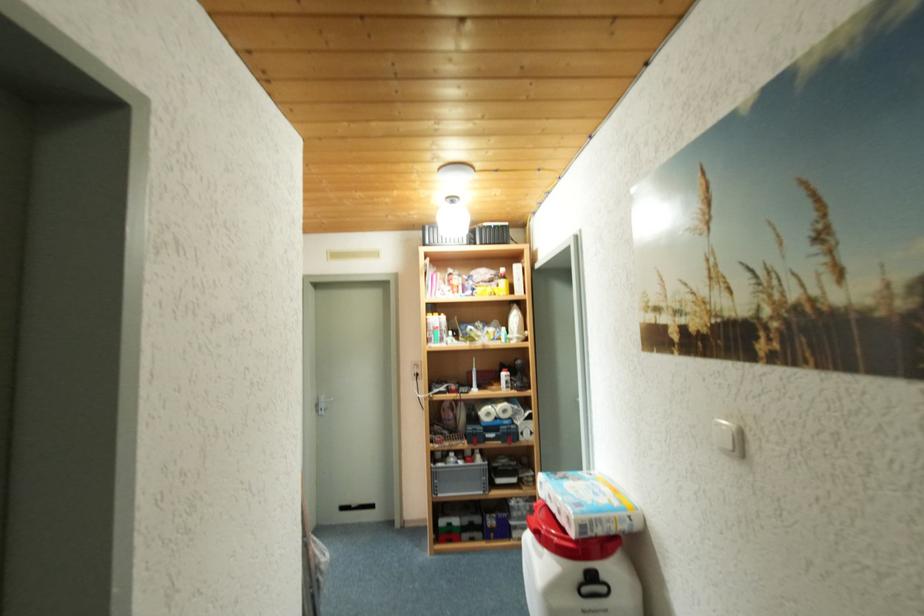
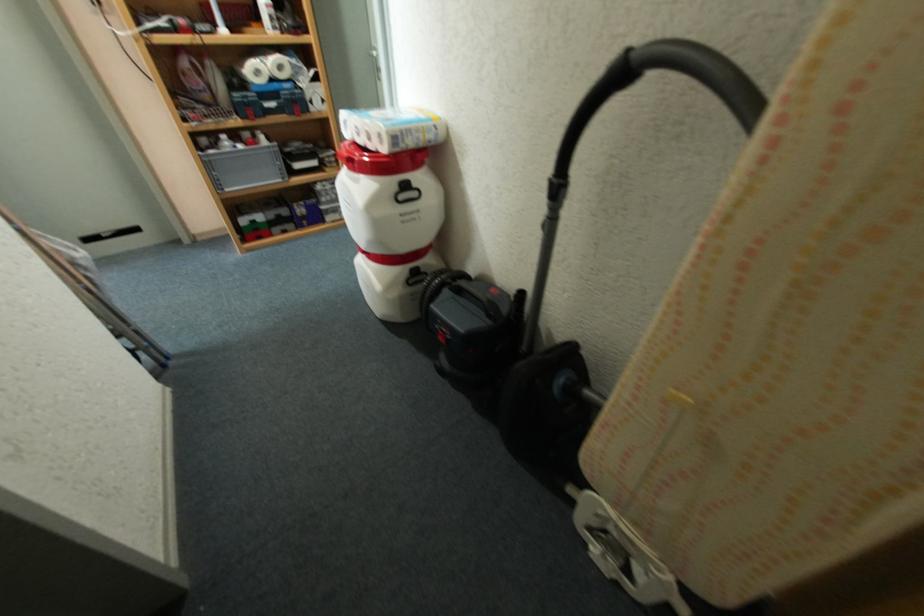
First-person continuous shooting, in which direction is the camera rotating?

The camera rotated toward right-down.